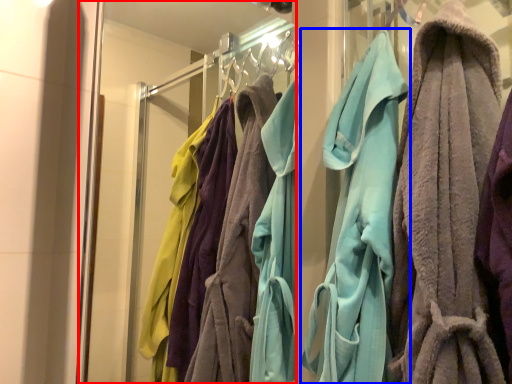
Question: Among these objects, which one is farthest to the camera, glass door (highlighted by a red box) or towel (highlighted by a blue box)?

Choices:
 (A) glass door
 (B) towel

Answer: (B)